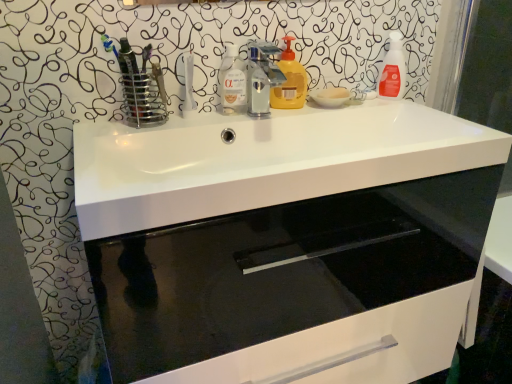
What do you see at coordinates (290, 81) in the screenshot? This screenshot has width=512, height=384. I see `yellow matte liquid soap at center, which is the second cleaning product in right-to-left order` at bounding box center [290, 81].

The width and height of the screenshot is (512, 384). In order to click on transparent liquid at center, positioned as the first cleaning product in left-to-right order in this screenshot , I will do `click(232, 82)`.

Is white glossy cabinet at center shorter than transparent liquid at center, positioned as the first cleaning product in left-to-right order?

No, white glossy cabinet at center is not shorter than transparent liquid at center, positioned as the first cleaning product in left-to-right order.

Locate an element on the screen. the 1st cleaning product above the white glossy cabinet at center (from the image's perspective) is located at coordinates (232, 82).

Which point is more forward, (303,279) or (234,90)?

The point (234,90) is more forward.

Could you measure the distance between white glossy cabinet at center and transparent liquid at center, positioned as the first cleaning product in left-to-right order?

white glossy cabinet at center is 86.92 centimeters from transparent liquid at center, positioned as the first cleaning product in left-to-right order.

Could you tell me if metallic silver faucet at center is facing transparent liquid at center, positioned as the first cleaning product in left-to-right order?

No, metallic silver faucet at center is not turned towards transparent liquid at center, positioned as the first cleaning product in left-to-right order.

From the image's perspective, which one is positioned lower, metallic silver faucet at center or transparent liquid at center, positioned as the first cleaning product in left-to-right order?

metallic silver faucet at center, from the image's perspective.

In the scene shown: Is the surface of metallic silver faucet at center in direct contact with transparent liquid at center, positioned as the first cleaning product in left-to-right order?

Yes, metallic silver faucet at center is next to transparent liquid at center, positioned as the first cleaning product in left-to-right order.

Which of these two, metallic silver faucet at center or transparent liquid at center, positioned as the first cleaning product in left-to-right order, is thinner?

transparent liquid at center, positioned as the first cleaning product in left-to-right order, is thinner.

Between white glossy cabinet at center and metallic silver faucet at center, which one appears on the right side from the viewer's perspective?

white glossy cabinet at center is more to the right.

Is white glossy cabinet at center located outside metallic silver faucet at center?

That's correct, white glossy cabinet at center is outside of metallic silver faucet at center.

Is point (227, 277) positioned before point (270, 64)?

No, it is not.

Can you confirm if white glossy cabinet at center is thinner than metallic silver faucet at center?

No, white glossy cabinet at center is not thinner than metallic silver faucet at center.

Can you see white glossy sink at center touching translucent orange spray bottle at upper right, which is counted as the first cleaning product, starting from the right?

There is a gap between white glossy sink at center and translucent orange spray bottle at upper right, which is counted as the first cleaning product, starting from the right.

From the image's perspective, is white glossy sink at center under translucent orange spray bottle at upper right, acting as the 3th cleaning product starting from the left?

Correct, white glossy sink at center appears lower than translucent orange spray bottle at upper right, acting as the 3th cleaning product starting from the left, in the image.

Is point (126, 211) closer or farther from the camera than point (400, 89)?

Point (126, 211) is positioned closer to the camera compared to point (400, 89).

Is transparent liquid at center, the third cleaning product when ordered from right to left, taller or shorter than white glossy sink at center?

Clearly, transparent liquid at center, the third cleaning product when ordered from right to left, is taller compared to white glossy sink at center.

Are transparent liquid at center, the third cleaning product when ordered from right to left, and white glossy sink at center located far from each other?

They are positioned close to each other.

Is transparent liquid at center, the third cleaning product when ordered from right to left, surrounding white glossy sink at center?

No, white glossy sink at center is located outside of transparent liquid at center, the third cleaning product when ordered from right to left.

Between transparent liquid at center, positioned as the first cleaning product in left-to-right order, and white glossy sink at center, which one has larger width?

white glossy sink at center is wider.

Is yellow matte liquid soap at center, marked as the second cleaning product in a left-to-right arrangement, positioned with its back to white glossy sink at center?

No, yellow matte liquid soap at center, marked as the second cleaning product in a left-to-right arrangement, is not facing the opposite direction of white glossy sink at center.

From the image's perspective, is yellow matte liquid soap at center, marked as the second cleaning product in a left-to-right arrangement, positioned above or below white glossy sink at center?

yellow matte liquid soap at center, marked as the second cleaning product in a left-to-right arrangement, is above white glossy sink at center.

Find the location of a particular element. sink in front of the yellow matte liquid soap at center, which is the second cleaning product in right-to-left order is located at coordinates (263, 161).

Which is less distant, (x=273, y=107) or (x=390, y=36)?

Point (x=273, y=107).

From a real-world perspective, does yellow matte liquid soap at center, marked as the second cleaning product in a left-to-right arrangement, stand above translucent orange spray bottle at upper right, which is counted as the first cleaning product, starting from the right?

No, from a real-world perspective, yellow matte liquid soap at center, marked as the second cleaning product in a left-to-right arrangement, is not over translucent orange spray bottle at upper right, which is counted as the first cleaning product, starting from the right

Looking at this image, is yellow matte liquid soap at center, which is the second cleaning product in right-to-left order, bigger than translucent orange spray bottle at upper right, which is counted as the first cleaning product, starting from the right?

No, yellow matte liquid soap at center, which is the second cleaning product in right-to-left order, is not bigger than translucent orange spray bottle at upper right, which is counted as the first cleaning product, starting from the right.

From the image's perspective, which is above, yellow matte liquid soap at center, which is the second cleaning product in right-to-left order, or translucent orange spray bottle at upper right, acting as the 3th cleaning product starting from the left?

translucent orange spray bottle at upper right, acting as the 3th cleaning product starting from the left.

Image resolution: width=512 pixels, height=384 pixels. I want to click on bathroom cabinet that is in front of the transparent liquid at center, the third cleaning product when ordered from right to left, so click(x=294, y=280).

From a real-world perspective, starting from the metallic silver faucet at center, which cleaning product is the 1st one below it? Please provide its 2D coordinates.

[(232, 82)]

Considering their positions, is white glossy cabinet at center positioned further to translucent orange spray bottle at upper right, which is counted as the first cleaning product, starting from the right, than white glossy sink at center?

Based on the image, white glossy cabinet at center appears to be further to translucent orange spray bottle at upper right, which is counted as the first cleaning product, starting from the right.

Estimate the real-world distances between objects in this image. Which object is further from translucent orange spray bottle at upper right, acting as the 3th cleaning product starting from the left, metallic silver faucet at center or white glossy sink at center?

white glossy sink at center is positioned further to the anchor translucent orange spray bottle at upper right, acting as the 3th cleaning product starting from the left.

Estimate the real-world distances between objects in this image. Which object is further from transparent liquid at center, the third cleaning product when ordered from right to left, yellow matte liquid soap at center, which is the second cleaning product in right-to-left order, or metallic silver faucet at center?

The object further to transparent liquid at center, the third cleaning product when ordered from right to left, is yellow matte liquid soap at center, which is the second cleaning product in right-to-left order.

Based on their spatial positions, is white glossy cabinet at center or white glossy sink at center closer to transparent liquid at center, the third cleaning product when ordered from right to left?

The object closer to transparent liquid at center, the third cleaning product when ordered from right to left, is white glossy sink at center.

Looking at the image, which one is located closer to metallic silver faucet at center, translucent orange spray bottle at upper right, acting as the 3th cleaning product starting from the left, or white glossy cabinet at center?

Among the two, translucent orange spray bottle at upper right, acting as the 3th cleaning product starting from the left, is located nearer to metallic silver faucet at center.

From the image, which object appears to be nearer to white glossy cabinet at center, white glossy sink at center or translucent orange spray bottle at upper right, acting as the 3th cleaning product starting from the left?

white glossy sink at center.

From the image, which object appears to be nearer to white glossy sink at center, yellow matte liquid soap at center, which is the second cleaning product in right-to-left order, or metallic silver faucet at center?

yellow matte liquid soap at center, which is the second cleaning product in right-to-left order, lies closer to white glossy sink at center than the other object.

Estimate the real-world distances between objects in this image. Which object is closer to white glossy cabinet at center, metallic silver faucet at center or transparent liquid at center, the third cleaning product when ordered from right to left?

metallic silver faucet at center is closer to white glossy cabinet at center.

The image size is (512, 384). I want to click on tap between white glossy sink at center and yellow matte liquid soap at center, which is the second cleaning product in right-to-left order, along the z-axis, so click(x=262, y=76).

Where is `tap between white glossy sink at center and transparent liquid at center, the third cleaning product when ordered from right to left, in the front-back direction`? The height and width of the screenshot is (384, 512). tap between white glossy sink at center and transparent liquid at center, the third cleaning product when ordered from right to left, in the front-back direction is located at coordinates (262, 76).

Identify the location of cleaning product situated between metallic silver faucet at center and translucent orange spray bottle at upper right, acting as the 3th cleaning product starting from the left, from left to right. The image size is (512, 384). (290, 81).

Locate an element on the screen. Image resolution: width=512 pixels, height=384 pixels. tap between white glossy sink at center and translucent orange spray bottle at upper right, acting as the 3th cleaning product starting from the left, in the front-back direction is located at coordinates (262, 76).